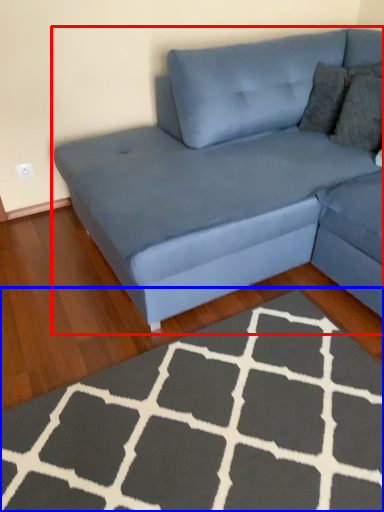
Question: Which object is closer to the camera taking this photo, studio couch (highlighted by a red box) or doormat (highlighted by a blue box)?

Choices:
 (A) studio couch
 (B) doormat

Answer: (B)